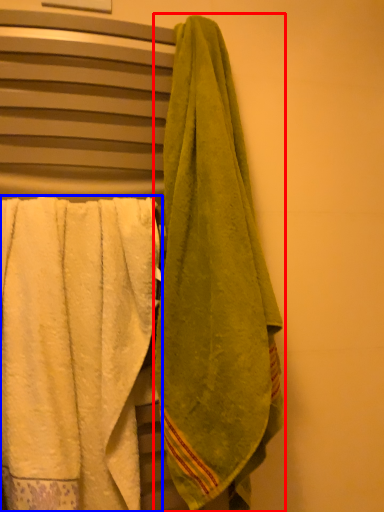
Question: Which of the following is the closest to the observer, towel (highlighted by a red box) or towel (highlighted by a blue box)?

Choices:
 (A) towel
 (B) towel

Answer: (A)